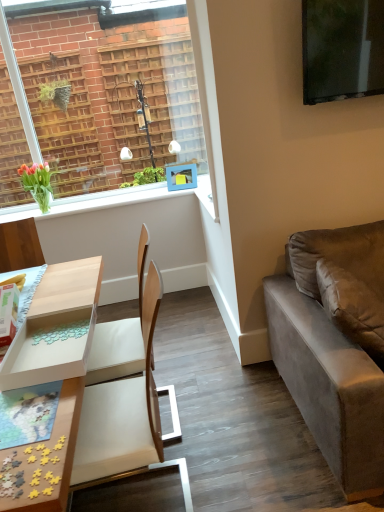
Question: Is green matte vase at upper left not within matte black television at upper right?

Choices:
 (A) yes
 (B) no

Answer: (A)

Question: Can you confirm if green matte vase at upper left is bigger than matte black television at upper right?

Choices:
 (A) no
 (B) yes

Answer: (A)

Question: From the image's perspective, does green matte vase at upper left appear higher than matte black television at upper right?

Choices:
 (A) no
 (B) yes

Answer: (A)

Question: From the image's perspective, is green matte vase at upper left located beneath matte black television at upper right?

Choices:
 (A) no
 (B) yes

Answer: (B)

Question: Is green matte vase at upper left beside matte black television at upper right?

Choices:
 (A) yes
 (B) no

Answer: (B)

Question: Can you confirm if green matte vase at upper left is taller than matte black television at upper right?

Choices:
 (A) no
 (B) yes

Answer: (A)

Question: Are green glass vase at upper left and green matte vase at upper left far apart?

Choices:
 (A) yes
 (B) no

Answer: (B)

Question: Considering the relative positions of green glass vase at upper left and green matte vase at upper left in the image provided, is green glass vase at upper left to the right of green matte vase at upper left from the viewer's perspective?

Choices:
 (A) yes
 (B) no

Answer: (A)

Question: From the image's perspective, is green glass vase at upper left located above green matte vase at upper left?

Choices:
 (A) no
 (B) yes

Answer: (A)

Question: Is green glass vase at upper left closer to the viewer compared to green matte vase at upper left?

Choices:
 (A) yes
 (B) no

Answer: (B)

Question: From the image's perspective, would you say green glass vase at upper left is shown under green matte vase at upper left?

Choices:
 (A) yes
 (B) no

Answer: (A)

Question: Is green glass vase at upper left oriented away from green matte vase at upper left?

Choices:
 (A) no
 (B) yes

Answer: (A)

Question: From a real-world perspective, is light blue plastic picture frame at upper center positioned over suede gray couch at right based on gravity?

Choices:
 (A) yes
 (B) no

Answer: (A)